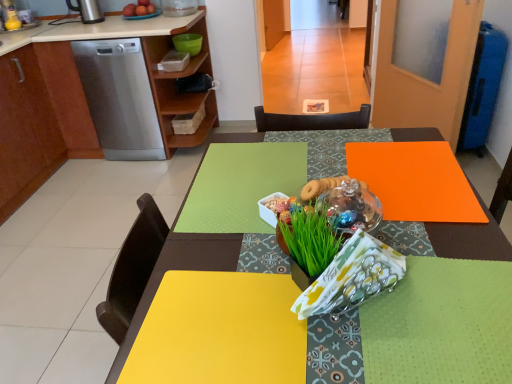
I want to click on vacant space situated above yellow matte placemat at center (from a real-world perspective), so click(359, 180).